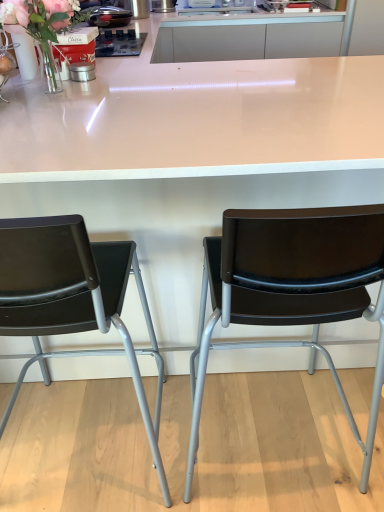
This screenshot has height=512, width=384. Describe the element at coordinates (192, 155) in the screenshot. I see `white glossy table at center` at that location.

Image resolution: width=384 pixels, height=512 pixels. What do you see at coordinates (45, 25) in the screenshot?
I see `translucent glass vase at upper left` at bounding box center [45, 25].

This screenshot has width=384, height=512. What do you see at coordinates (292, 288) in the screenshot?
I see `black plastic chair at center, the 1th chair in the right-to-left sequence` at bounding box center [292, 288].

What do you see at coordinates (107, 15) in the screenshot? Image resolution: width=384 pixels, height=512 pixels. I see `glossy metallic waffle maker at upper center, acting as the first appliance starting from the left` at bounding box center [107, 15].

What are the coordinates of `white glossy table at center` in the screenshot? It's located at (192, 155).

Can you tell me how much glossy metallic waffle maker at upper center, which appears as the 2th appliance when viewed from the top, and clear glass vase at left differ in facing direction?

There is a 0.504-degree angle between the facing directions of glossy metallic waffle maker at upper center, which appears as the 2th appliance when viewed from the top, and clear glass vase at left.

You are a GUI agent. You are given a task and a screenshot of the screen. Output one action in this format:
    pyautogui.click(x=<x>, y=<y>)
    Task: Click on the vase that is above the glossy metallic waffle maker at upper center, the second appliance when ordered from front to back (from a real-world perspective)
    
    Given the screenshot: What is the action you would take?
    pyautogui.click(x=49, y=69)

Which of these two, glossy metallic waffle maker at upper center, the second appliance when ordered from front to back, or clear glass vase at left, is smaller?

clear glass vase at left is smaller.

Does glossy metallic waffle maker at upper center, which is counted as the third appliance, starting from the right, lie in front of clear glass vase at left?

No, it is not.

Considering the sizes of objects metallic tin at upper left, marked as the 1th appliance in a bottom-to-top arrangement, and translucent glass vase at upper left in the image provided, who is thinner, metallic tin at upper left, marked as the 1th appliance in a bottom-to-top arrangement, or translucent glass vase at upper left?

With smaller width is metallic tin at upper left, marked as the 1th appliance in a bottom-to-top arrangement.

Considering the relative positions of metallic tin at upper left, which appears as the third appliance when viewed from the back, and translucent glass vase at upper left in the image provided, is metallic tin at upper left, which appears as the third appliance when viewed from the back, to the right of translucent glass vase at upper left from the viewer's perspective?

Correct, you'll find metallic tin at upper left, which appears as the third appliance when viewed from the back, to the right of translucent glass vase at upper left.

Considering the sizes of objects metallic tin at upper left, the second appliance viewed from the left, and translucent glass vase at upper left in the image provided, who is taller, metallic tin at upper left, the second appliance viewed from the left, or translucent glass vase at upper left?

With more height is translucent glass vase at upper left.

Which object is further away from the camera taking this photo, metallic tin at upper left, which appears as the third appliance when viewed from the back, or translucent glass vase at upper left?

metallic tin at upper left, which appears as the third appliance when viewed from the back, is behind.

From the image's perspective, between glossy metallic waffle maker at upper center, acting as the first appliance starting from the left, and translucent glass vase at upper left, which one is located above?

From the image's view, glossy metallic waffle maker at upper center, acting as the first appliance starting from the left, is above.

Is glossy metallic waffle maker at upper center, which is the second appliance from bottom to top, not near translucent glass vase at upper left?

No.

The height and width of the screenshot is (512, 384). I want to click on floral arrangement that is above the glossy metallic waffle maker at upper center, the second appliance when ordered from front to back (from a real-world perspective), so click(x=45, y=25).

Based on their positions, is glossy metallic waffle maker at upper center, arranged as the 2th appliance when viewed from the back, located to the left or right of translucent glass vase at upper left?

In the image, glossy metallic waffle maker at upper center, arranged as the 2th appliance when viewed from the back, appears on the left side of translucent glass vase at upper left.

Would you say metallic tin at upper left, arranged as the 2th appliance when viewed from the right, is to the left or to the right of matte black chair at left, the 2th chair viewed from the right, in the picture?

From the image, it's evident that metallic tin at upper left, arranged as the 2th appliance when viewed from the right, is to the right of matte black chair at left, the 2th chair viewed from the right.

Is metallic tin at upper left, the second appliance viewed from the left, thinner than matte black chair at left, the 2th chair viewed from the right?

Yes.

Are metallic tin at upper left, marked as the first appliance in a front-to-back arrangement, and matte black chair at left, the 1th chair from the left, beside each other?

metallic tin at upper left, marked as the first appliance in a front-to-back arrangement, and matte black chair at left, the 1th chair from the left, are not in contact.

Can you confirm if metallic tin at upper left, marked as the first appliance in a front-to-back arrangement, is smaller than matte black chair at left, the 2th chair viewed from the right?

Correct, metallic tin at upper left, marked as the first appliance in a front-to-back arrangement, occupies less space than matte black chair at left, the 2th chair viewed from the right.

The image size is (384, 512). In order to click on the 3rd appliance above the matte black chair at left, the 2th chair viewed from the right (from a real-world perspective) in this screenshot , I will do `click(107, 15)`.

Which is nearer, (100, 6) or (161, 393)?

The point (161, 393) is closer to the camera.

Is glossy metallic waffle maker at upper center, arranged as the 2th appliance when viewed from the back, positioned before matte black chair at left, the 2th chair viewed from the right?

No, it is not.

From a real-world perspective, is glossy metallic waffle maker at upper center, acting as the first appliance starting from the left, located beneath matte black chair at left, the 1th chair from the left?

No, from a real-world perspective, glossy metallic waffle maker at upper center, acting as the first appliance starting from the left, is not beneath matte black chair at left, the 1th chair from the left.

Does point (184, 203) appear closer or farther from the camera than point (153, 12)?

Clearly, point (184, 203) is closer to the camera than point (153, 12).

Which of these two, white glossy table at center or metallic silver canister at center, which is the third appliance in bottom-to-top order, stands taller?

With more height is white glossy table at center.

Looking at this image, which object is closer to the camera taking this photo, white glossy table at center or metallic silver canister at center, which appears as the first appliance when viewed from the right?

white glossy table at center.

Does point (279, 70) come in front of point (69, 27)?

No.

Image resolution: width=384 pixels, height=512 pixels. What are the coordinates of `floral arrangement behind the white glossy table at center` in the screenshot? It's located at (45, 25).

Is white glossy table at center directly adjacent to translucent glass vase at upper left?

No, white glossy table at center is not in contact with translucent glass vase at upper left.

Is white glossy table at center oriented away from translucent glass vase at upper left?

No, white glossy table at center's orientation is not away from translucent glass vase at upper left.

From a real-world perspective, count 1st appliances downward from the clear glass vase at left and point to it. Please provide its 2D coordinates.

[(107, 15)]

From the image's perspective, which appliance is the 1st one above the translucent glass vase at upper left? Please provide its 2D coordinates.

[(82, 71)]

Which object lies further to the anchor point translucent glass vase at upper left, glossy metallic waffle maker at upper center, which is counted as the third appliance, starting from the right, or white glossy table at center?

white glossy table at center is positioned further to the anchor translucent glass vase at upper left.

Based on their spatial positions, is black plastic chair at center, the 1th chair in the right-to-left sequence, or translucent glass vase at upper left further from glossy metallic waffle maker at upper center, acting as the first appliance starting from the left?

black plastic chair at center, the 1th chair in the right-to-left sequence, lies further to glossy metallic waffle maker at upper center, acting as the first appliance starting from the left, than the other object.

From the image, which object appears to be farther from black plastic chair at center, the 1th chair in the right-to-left sequence, glossy metallic waffle maker at upper center, which is the second appliance from bottom to top, or matte black chair at left, the 2th chair viewed from the right?

glossy metallic waffle maker at upper center, which is the second appliance from bottom to top, is further to black plastic chair at center, the 1th chair in the right-to-left sequence.

Which object lies nearer to the anchor point metallic silver canister at center, which appears as the third appliance when viewed from the left, clear glass vase at left or glossy metallic waffle maker at upper center, which appears as the 2th appliance when viewed from the top?

glossy metallic waffle maker at upper center, which appears as the 2th appliance when viewed from the top.

Based on their spatial positions, is black plastic chair at center, which is counted as the 2th chair, starting from the left, or white glossy table at center closer to metallic silver canister at center, the third appliance in the front-to-back sequence?

The object closer to metallic silver canister at center, the third appliance in the front-to-back sequence, is white glossy table at center.

Estimate the real-world distances between objects in this image. Which object is closer to white glossy table at center, glossy metallic waffle maker at upper center, arranged as the 2th appliance when viewed from the back, or metallic tin at upper left, marked as the 1th appliance in a bottom-to-top arrangement?

Among the two, metallic tin at upper left, marked as the 1th appliance in a bottom-to-top arrangement, is located nearer to white glossy table at center.

From the image, which object appears to be farther from matte black chair at left, the 2th chair viewed from the right, black plastic chair at center, the 1th chair in the right-to-left sequence, or translucent glass vase at upper left?

translucent glass vase at upper left is positioned further to the anchor matte black chair at left, the 2th chair viewed from the right.

From the image, which object appears to be nearer to glossy metallic waffle maker at upper center, arranged as the 2th appliance when viewed from the back, white glossy table at center or matte black chair at left, the 1th chair from the left?

Based on the image, white glossy table at center appears to be nearer to glossy metallic waffle maker at upper center, arranged as the 2th appliance when viewed from the back.

At what (x,y) coordinates should I click in order to perform the action: click on table between translucent glass vase at upper left and matte black chair at left, the 2th chair viewed from the right, in the vertical direction. Please return your answer as a coordinate pair (x, y). Looking at the image, I should click on (192, 155).

In order to click on appliance positioned between clear glass vase at left and glossy metallic waffle maker at upper center, which appears as the 2th appliance when viewed from the top, from near to far in this screenshot , I will do tap(82, 71).

Where is `floral arrangement located between black plastic chair at center, the 1th chair in the right-to-left sequence, and metallic silver canister at center, which is the third appliance in bottom-to-top order, in the depth direction`? This screenshot has height=512, width=384. floral arrangement located between black plastic chair at center, the 1th chair in the right-to-left sequence, and metallic silver canister at center, which is the third appliance in bottom-to-top order, in the depth direction is located at coordinates (45, 25).

This screenshot has height=512, width=384. What are the coordinates of `appliance positioned between black plastic chair at center, which is counted as the 2th chair, starting from the left, and glossy metallic waffle maker at upper center, acting as the first appliance starting from the left, from near to far` in the screenshot? It's located at (82, 71).